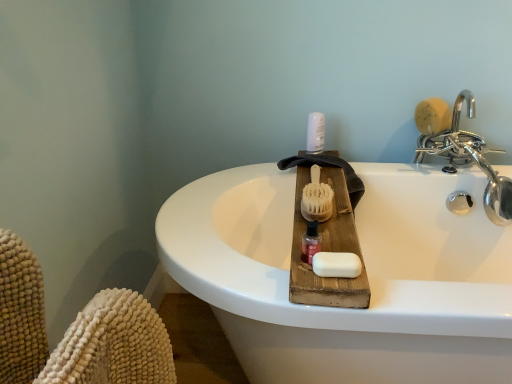
This screenshot has height=384, width=512. Find the location of `free space behind white matte soap at center`. free space behind white matte soap at center is located at coordinates (326, 226).